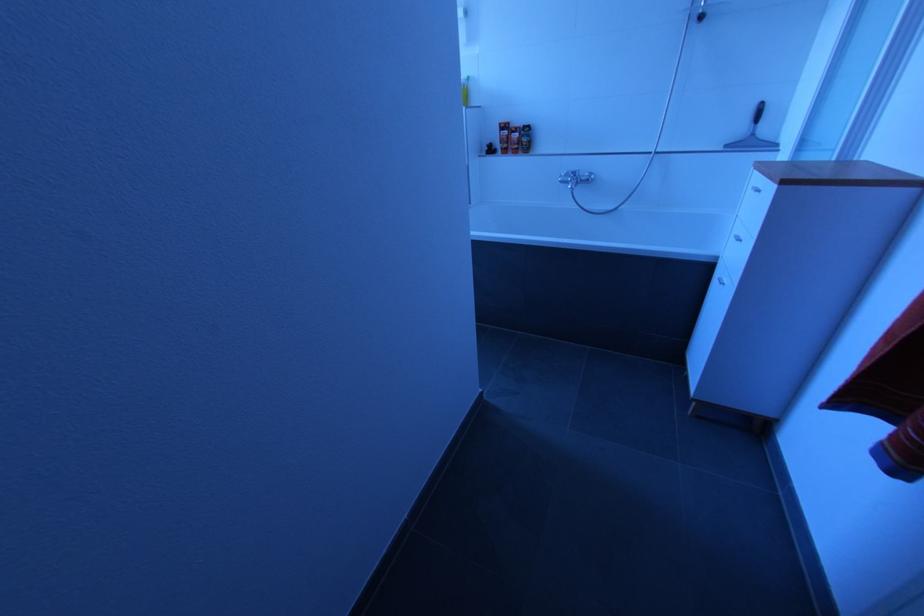
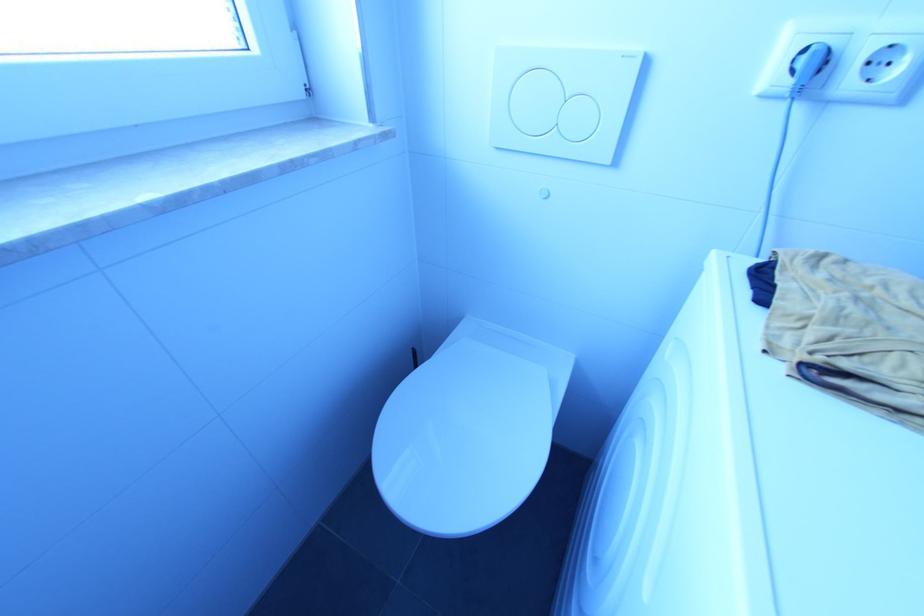
In a continuous first-person perspective shot, in which direction is the camera moving?

The movement direction of the cameraman is left, forward.